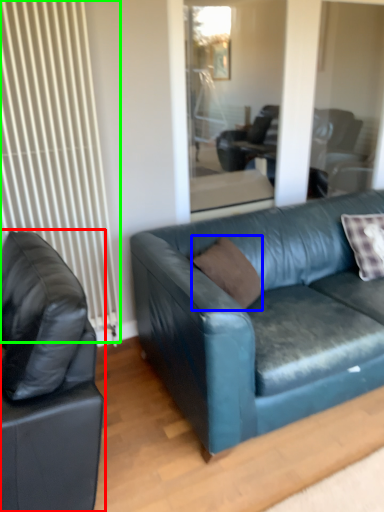
Question: Which is nearer to the studio couch (highlighted by a red box)? pillow (highlighted by a blue box) or radiator (highlighted by a green box).

Choices:
 (A) pillow
 (B) radiator

Answer: (B)